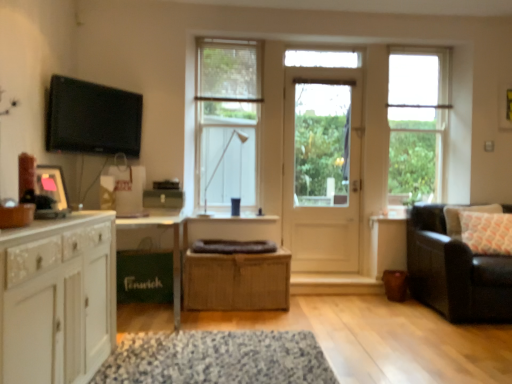
Question: In terms of height, does matte black picture frame at left look taller or shorter compared to white wooden door at center?

Choices:
 (A) tall
 (B) short

Answer: (B)

Question: Looking at their shapes, would you say matte black picture frame at left is wider or thinner than white wooden door at center?

Choices:
 (A) wide
 (B) thin

Answer: (B)

Question: Estimate the real-world distances between objects in this image. Which object is closer to the white wooden door at center?

Choices:
 (A) white wood cabinet at left, the second cabinetry when ordered from back to front
 (B) bamboo cabinet at center, arranged as the second cabinetry when viewed from the front
 (C) clear glass window at center, marked as the 2th window in a right-to-left arrangement
 (D) speckled fabric mat at center
 (E) clear glass window at upper right, acting as the 2th window starting from the left

Answer: (E)

Question: Estimate the real-world distances between objects in this image. Which object is farther from the white wooden door at center?

Choices:
 (A) bamboo cabinet at center, marked as the 2th cabinetry in a left-to-right arrangement
 (B) leather couch at right
 (C) clear glass window at center, which is counted as the 1th window, starting from the left
 (D) patterned fabric pillow at right
 (E) matte black picture frame at left

Answer: (E)